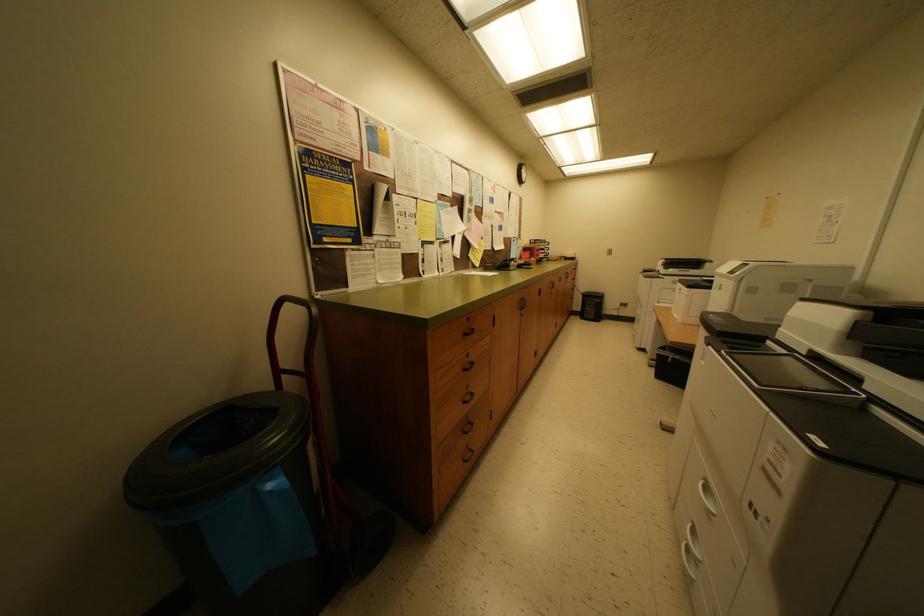
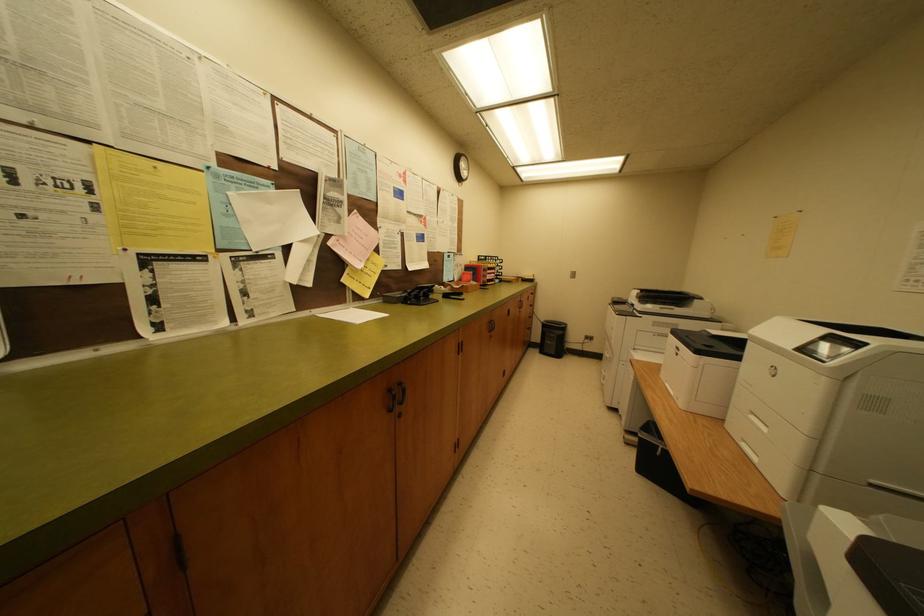
Which direction would the cameraman need to move to produce the second image?

The cameraman walked toward right, forward.